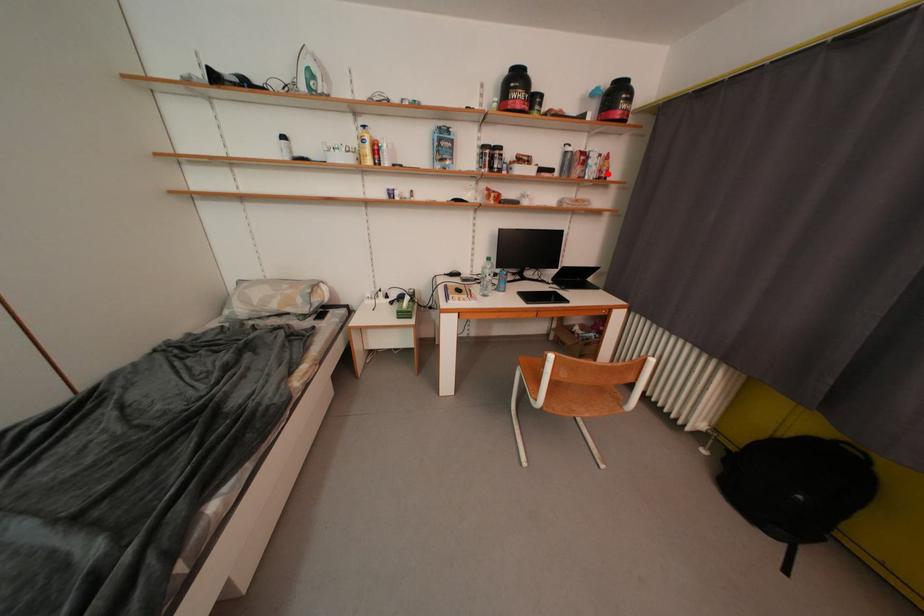
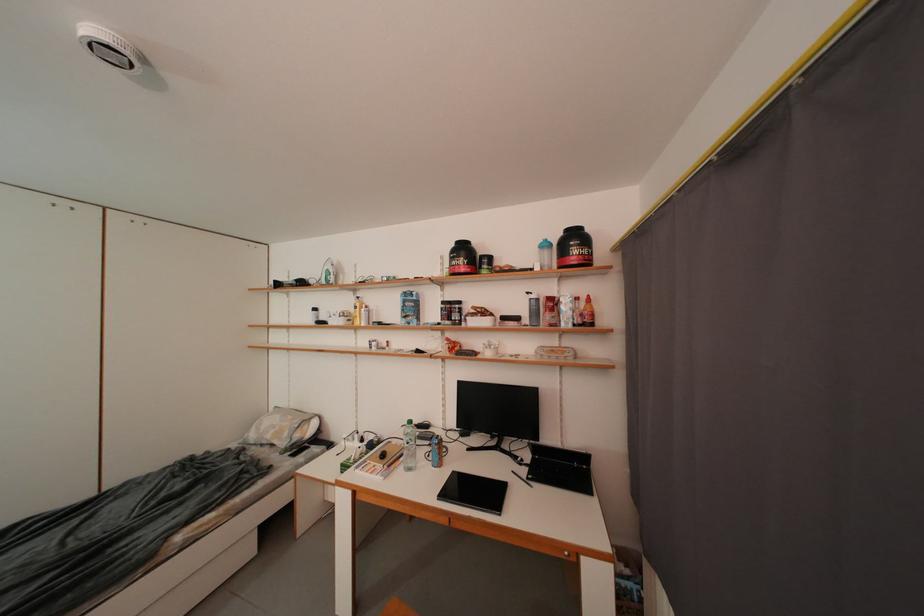
Find the pixel in the second image that matches the highlighted location in the first image.

(590, 318)